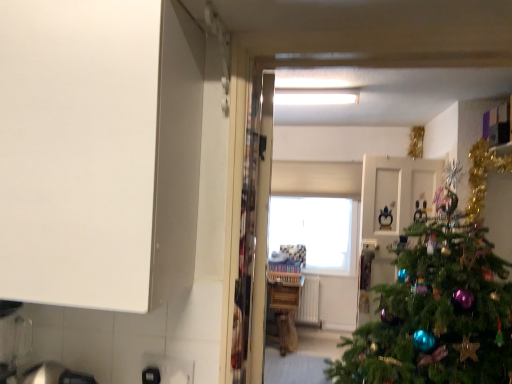
Question: Is point (416, 195) closer or farther from the camera than point (280, 291)?

Choices:
 (A) closer
 (B) farther

Answer: (A)

Question: Is white glossy door at center taller or shorter than wooden counter at center?

Choices:
 (A) short
 (B) tall

Answer: (B)

Question: Which object is positioned farthest from the green matte christmas tree at right?

Choices:
 (A) wooden counter at center
 (B) transparent glass window at center
 (C) white glossy door at center

Answer: (B)

Question: Considering the real-world distances, which object is closest to the white glossy door at center?

Choices:
 (A) green matte christmas tree at right
 (B) transparent glass window at center
 (C) wooden counter at center

Answer: (A)